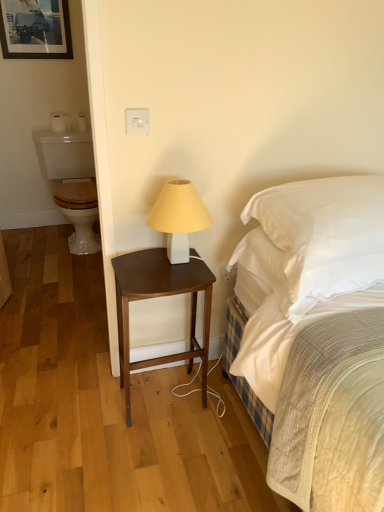
Where is `free space in front of dark wood nightstand at center`? free space in front of dark wood nightstand at center is located at coordinates (165, 457).